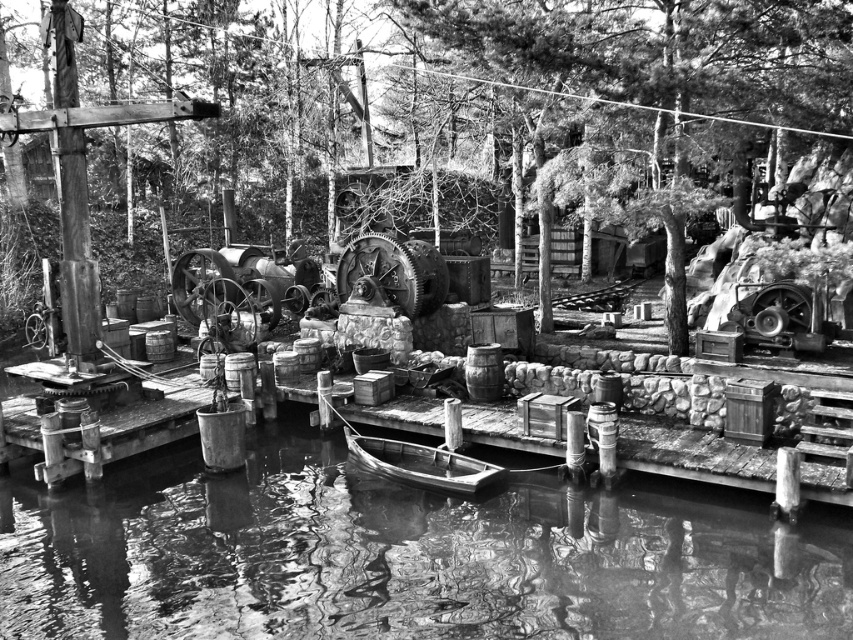
Question: Can you confirm if smooth water at center is bigger than wooden raft at center?

Choices:
 (A) yes
 (B) no

Answer: (A)

Question: Is smooth water at center bigger than wooden raft at center?

Choices:
 (A) no
 (B) yes

Answer: (B)

Question: Which point is closer to the camera?

Choices:
 (A) (415, 460)
 (B) (389, 573)

Answer: (B)

Question: Does smooth water at center appear under wooden raft at center?

Choices:
 (A) yes
 (B) no

Answer: (A)

Question: Which of the following is the farthest from the observer?

Choices:
 (A) (451, 456)
 (B) (724, 508)

Answer: (A)

Question: Among these points, which one is nearest to the camera?

Choices:
 (A) (392, 464)
 (B) (769, 531)

Answer: (B)